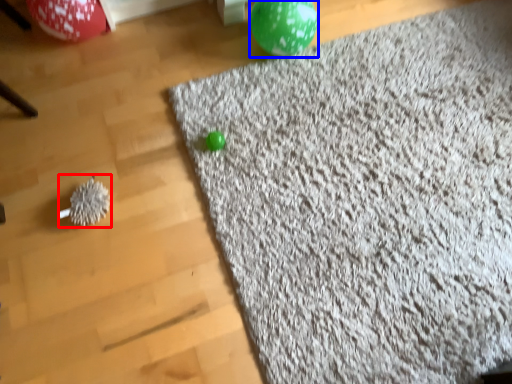
Question: Which object appears farthest to the camera in this image, toy (highlighted by a red box) or balloon (highlighted by a blue box)?

Choices:
 (A) toy
 (B) balloon

Answer: (B)